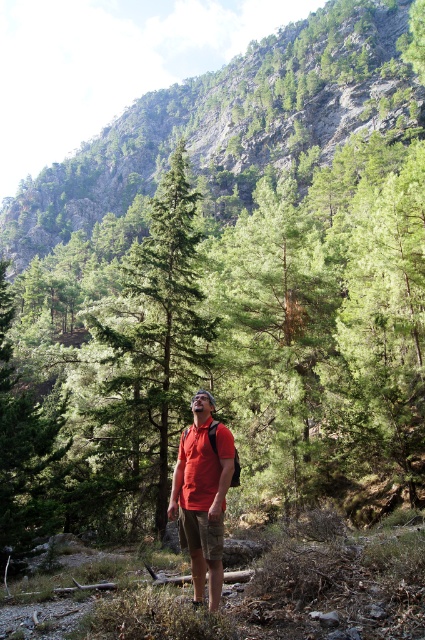
Based on the photo, you are a hiker who wants to take a photo of the matte red shirt at center and the green matte tree at center. Which object should you focus on first if you want to capture both in the same frame without moving the camera?

The green matte tree at center is larger in size compared to the matte red shirt at center, so you should focus on the green matte tree at center first to ensure it fills the frame appropriately before adjusting for the smaller matte red shirt at center.